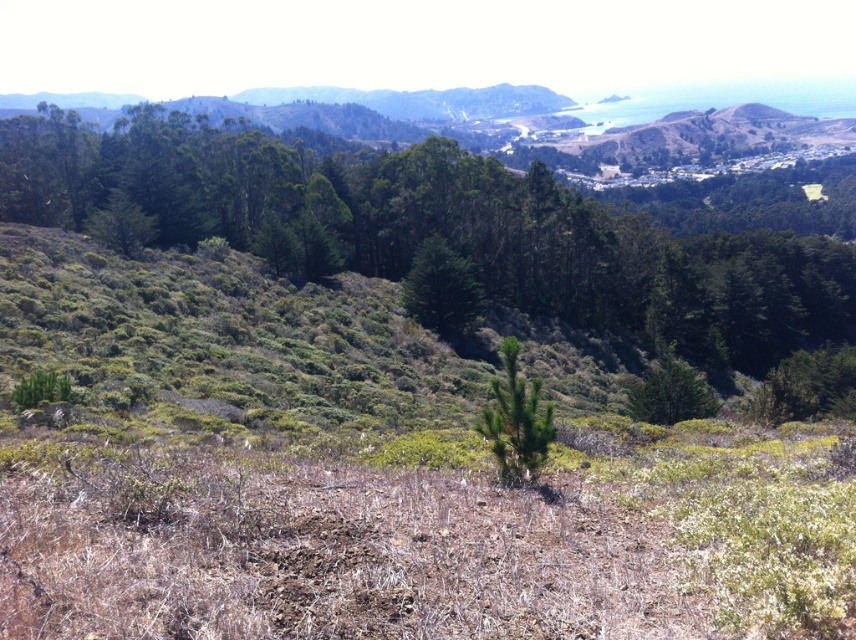
Who is shorter, green matte tree at center or green textured tree at center?

green matte tree at center is shorter.

Who is lower down, green matte tree at center or green textured tree at center?

green matte tree at center

Between point (504, 444) and point (476, 321), which one is positioned in front?

Positioned in front is point (504, 444).

Where is `green matte tree at center`? Image resolution: width=856 pixels, height=640 pixels. green matte tree at center is located at coordinates (516, 420).

Is green leafy tree at upper center thinner than green textured tree at center?

In fact, green leafy tree at upper center might be wider than green textured tree at center.

Is green leafy tree at upper center to the left of green textured tree at center from the viewer's perspective?

In fact, green leafy tree at upper center is to the right of green textured tree at center.

Is point (747, 300) less distant than point (447, 321)?

No, it is not.

The width and height of the screenshot is (856, 640). Find the location of `green leafy tree at upper center`. green leafy tree at upper center is located at coordinates (432, 230).

The image size is (856, 640). What do you see at coordinates (516, 420) in the screenshot? I see `green matte tree at center` at bounding box center [516, 420].

Does point (521, 444) lie in front of point (664, 380)?

Yes.

Identify the location of green matte tree at center. (516, 420).